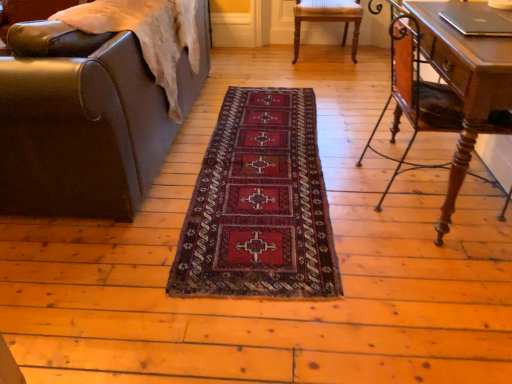
In order to face leather at left, marked as the second chair in a back-to-front arrangement, should I rotate leftwards or rightwards?

To face it directly, rotate left by 21.134 degrees.

In the scene shown: What is the approximate height of leather at left, arranged as the 2th chair when viewed from the right?

leather at left, arranged as the 2th chair when viewed from the right, is 34.28 inches in height.

What are the coordinates of `wooden chair at center, marked as the 2th chair in a left-to-right arrangement` in the screenshot? It's located at (328, 19).

Measure the distance between wooden chair at center, which is the 1th chair from right to left, and camera.

wooden chair at center, which is the 1th chair from right to left, is 11.65 feet away from camera.

Locate an element on the screen. dark red woven rug at center is located at coordinates 259,204.

Where is `leather at left, arranged as the 2th chair when viewed from the right`? The image size is (512, 384). leather at left, arranged as the 2th chair when viewed from the right is located at coordinates (79, 124).

Does wooden chair at center, which is the 1th chair from right to left, have a smaller size compared to wooden desk at right?

Yes, wooden chair at center, which is the 1th chair from right to left, is smaller than wooden desk at right.

Based on the photo, relative to wooden desk at right, is wooden chair at center, which is the 1th chair from right to left, in front or behind?

Clearly, wooden chair at center, which is the 1th chair from right to left, is behind wooden desk at right.

From the image's perspective, is wooden chair at center, which appears as the 2th chair when viewed from the front, under wooden desk at right?

Incorrect, from the image's perspective, wooden chair at center, which appears as the 2th chair when viewed from the front, is higher than wooden desk at right.

Is wooden chair at center, which appears as the 1th chair when viewed from the back, spatially inside wooden desk at right, or outside of it?

wooden chair at center, which appears as the 1th chair when viewed from the back, is not inside wooden desk at right, it's outside.

Can you confirm if leather at left, arranged as the first chair when viewed from the front, is smaller than wooden desk at right?

No, leather at left, arranged as the first chair when viewed from the front, is not smaller than wooden desk at right.

Is leather at left, which is the 1th chair from left to right, at the left side of wooden desk at right?

Correct, you'll find leather at left, which is the 1th chair from left to right, to the left of wooden desk at right.

From a real-world perspective, between leather at left, arranged as the 2th chair when viewed from the right, and wooden desk at right, who is vertically lower?

wooden desk at right is physically lower.

Which is behind, leather at left, arranged as the first chair when viewed from the front, or wooden desk at right?

leather at left, arranged as the first chair when viewed from the front, is more distant.

Is leather at left, marked as the second chair in a back-to-front arrangement, in front of or behind wooden chair at center, marked as the 2th chair in a left-to-right arrangement, in the image?

Visually, leather at left, marked as the second chair in a back-to-front arrangement, is located in front of wooden chair at center, marked as the 2th chair in a left-to-right arrangement.

Is leather at left, arranged as the first chair when viewed from the front, positioned far away from wooden chair at center, marked as the 2th chair in a left-to-right arrangement?

Yes.

Is leather at left, arranged as the first chair when viewed from the front, situated inside wooden chair at center, which appears as the 1th chair when viewed from the back, or outside?

leather at left, arranged as the first chair when viewed from the front, is spatially situated outside wooden chair at center, which appears as the 1th chair when viewed from the back.

From the image's perspective, is wooden chair at center, which appears as the 1th chair when viewed from the back, positioned above or below silver metallic laptop at upper right?

Based on their image positions, wooden chair at center, which appears as the 1th chair when viewed from the back, is located above silver metallic laptop at upper right.

From the picture: Measure the distance from wooden chair at center, marked as the 2th chair in a left-to-right arrangement, to silver metallic laptop at upper right.

wooden chair at center, marked as the 2th chair in a left-to-right arrangement, is 2.00 meters away from silver metallic laptop at upper right.

The width and height of the screenshot is (512, 384). There is a wooden chair at center, which appears as the 2th chair when viewed from the front. Identify the location of laptop above it (from a real-world perspective). (477, 22).

Based on the photo, in the image, is wooden chair at center, which appears as the 2th chair when viewed from the front, positioned in front of or behind silver metallic laptop at upper right?

Visually, wooden chair at center, which appears as the 2th chair when viewed from the front, is located behind silver metallic laptop at upper right.

Based on the photo, can you confirm if wooden desk at right is wider than leather at left, arranged as the first chair when viewed from the front?

No, wooden desk at right is not wider than leather at left, arranged as the first chair when viewed from the front.

Is wooden desk at right not inside leather at left, arranged as the first chair when viewed from the front?

Yes.

From the image's perspective, is wooden desk at right above leather at left, arranged as the 2th chair when viewed from the right?

No.

Would you say wooden desk at right is a long distance from leather at left, which is the 1th chair from left to right?

Yes.

From a real-world perspective, is dark red woven rug at center located beneath wooden chair at center, which appears as the 2th chair when viewed from the front?

Yes, from a real-world perspective, dark red woven rug at center is under wooden chair at center, which appears as the 2th chair when viewed from the front.

Would you say dark red woven rug at center is a long distance from wooden chair at center, marked as the 2th chair in a left-to-right arrangement?

That's right, there is a large distance between dark red woven rug at center and wooden chair at center, marked as the 2th chair in a left-to-right arrangement.

Is wooden chair at center, marked as the 2th chair in a left-to-right arrangement, inside dark red woven rug at center?

No, wooden chair at center, marked as the 2th chair in a left-to-right arrangement, is located outside of dark red woven rug at center.

Is the position of dark red woven rug at center less distant than that of wooden chair at center, which is the 1th chair from right to left?

Yes.

Can you confirm if dark red woven rug at center is shorter than wooden desk at right?

Indeed, dark red woven rug at center has a lesser height compared to wooden desk at right.

Is dark red woven rug at center bigger than wooden desk at right?

Incorrect, dark red woven rug at center is not larger than wooden desk at right.

Is wooden desk at right at the back of dark red woven rug at center?

No, dark red woven rug at center is not facing away from wooden desk at right.

Find the location of a particular element. The width and height of the screenshot is (512, 384). table below the wooden chair at center, which appears as the 2th chair when viewed from the front (from the image's perspective) is located at coordinates (452, 82).

Locate an element on the screen. chair above the wooden desk at right (from a real-world perspective) is located at coordinates (79, 124).

Considering their positions, is wooden desk at right positioned closer to silver metallic laptop at upper right than leather at left, which is the 1th chair from left to right?

wooden desk at right lies closer to silver metallic laptop at upper right than the other object.

Considering their positions, is dark red woven rug at center positioned further to leather at left, arranged as the 2th chair when viewed from the right, than silver metallic laptop at upper right?

silver metallic laptop at upper right is positioned further to the anchor leather at left, arranged as the 2th chair when viewed from the right.

Based on their spatial positions, is leather at left, which is the 1th chair from left to right, or dark red woven rug at center further from silver metallic laptop at upper right?

leather at left, which is the 1th chair from left to right, lies further to silver metallic laptop at upper right than the other object.

Estimate the real-world distances between objects in this image. Which object is further from wooden desk at right, leather at left, arranged as the first chair when viewed from the front, or silver metallic laptop at upper right?

The object further to wooden desk at right is leather at left, arranged as the first chair when viewed from the front.

Based on their spatial positions, is wooden chair at center, which appears as the 1th chair when viewed from the back, or dark red woven rug at center closer to wooden desk at right?

Among the two, dark red woven rug at center is located nearer to wooden desk at right.

From the image, which object appears to be farther from silver metallic laptop at upper right, wooden chair at center, which appears as the 2th chair when viewed from the front, or leather at left, marked as the second chair in a back-to-front arrangement?

wooden chair at center, which appears as the 2th chair when viewed from the front, is further to silver metallic laptop at upper right.

Looking at this image, looking at the image, which one is located closer to silver metallic laptop at upper right, wooden chair at center, marked as the 2th chair in a left-to-right arrangement, or wooden desk at right?

Among the two, wooden desk at right is located nearer to silver metallic laptop at upper right.

Based on their spatial positions, is dark red woven rug at center or wooden chair at center, which is the 1th chair from right to left, closer to wooden desk at right?

dark red woven rug at center.

Identify the location of laptop between dark red woven rug at center and wooden chair at center, which appears as the 2th chair when viewed from the front, along the z-axis. (477, 22).

Locate an element on the screen. The width and height of the screenshot is (512, 384). laptop located between wooden desk at right and wooden chair at center, which appears as the 2th chair when viewed from the front, in the depth direction is located at coordinates (477, 22).

Locate an element on the screen. The width and height of the screenshot is (512, 384). mat between wooden desk at right and wooden chair at center, which appears as the 2th chair when viewed from the front, from front to back is located at coordinates (259, 204).

Where is `laptop between leather at left, arranged as the 2th chair when viewed from the right, and wooden chair at center, which appears as the 1th chair when viewed from the back, from front to back`? This screenshot has height=384, width=512. laptop between leather at left, arranged as the 2th chair when viewed from the right, and wooden chair at center, which appears as the 1th chair when viewed from the back, from front to back is located at coordinates (477, 22).